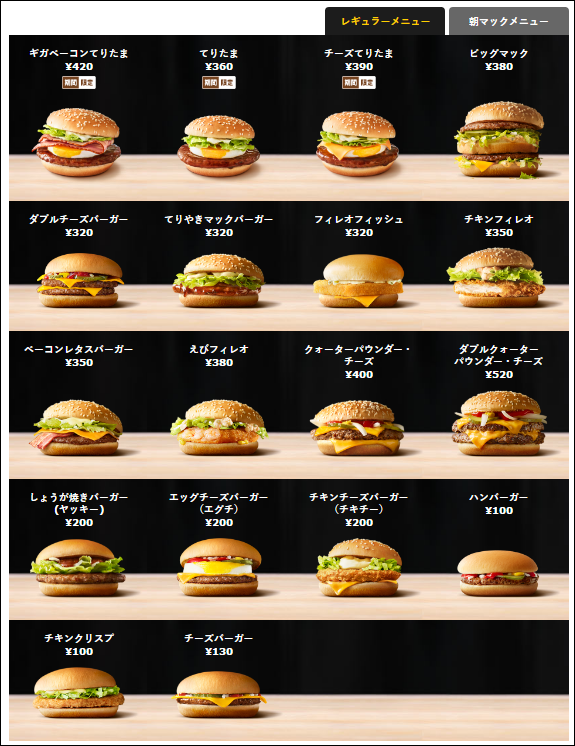
Where is `beige table`? This screenshot has width=575, height=746. beige table is located at coordinates (321, 712), (293, 604), (291, 470), (297, 307).